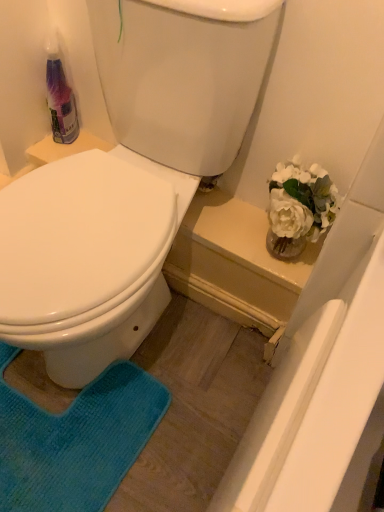
The height and width of the screenshot is (512, 384). In order to click on vacant space situated above blue textured rug at lower left (from a real-world perspective) in this screenshot , I will do `click(52, 425)`.